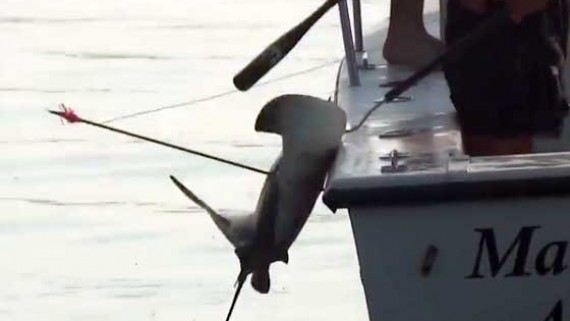
This screenshot has width=570, height=321. Find the location of `hook`. hook is located at coordinates (365, 113).